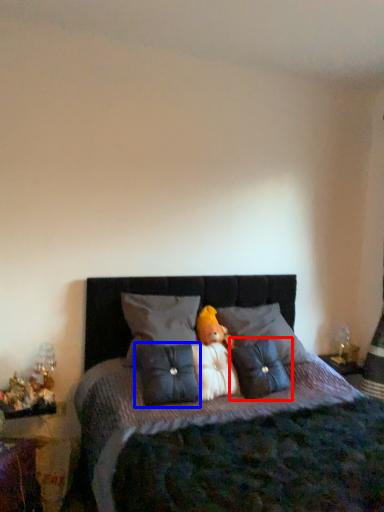
Question: Which point is closer to the camera, pillow (highlighted by a red box) or pillow (highlighted by a blue box)?

Choices:
 (A) pillow
 (B) pillow

Answer: (B)